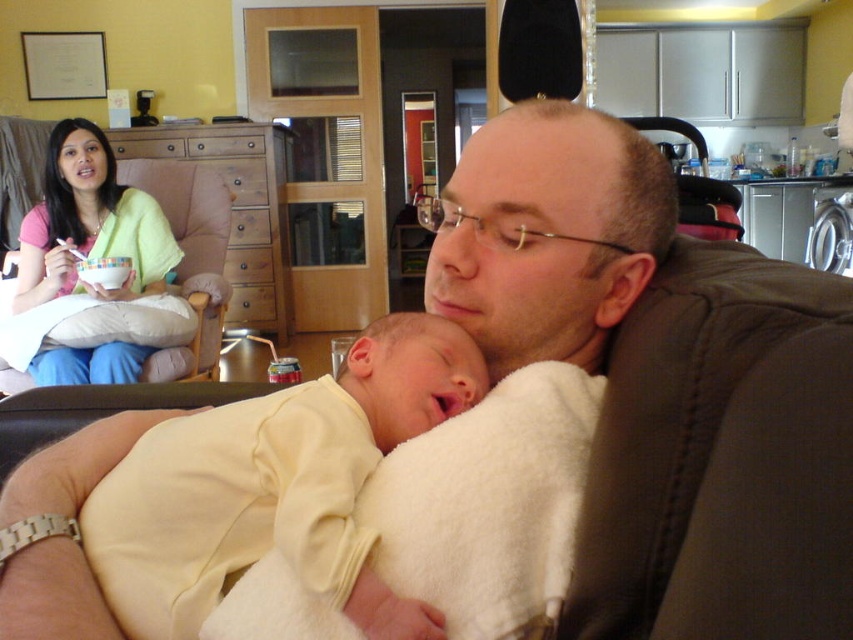
Is soft yellow onesie at center above smooth beige blanket at center?

No.

Does point (225, 420) lie behind point (570, 204)?

That is False.

Find the location of `soft yellow onesie at center`. soft yellow onesie at center is located at coordinates (276, 486).

Looking at this image, is smooth beige blanket at center to the left of pink fabric shirt at upper left from the viewer's perspective?

No, smooth beige blanket at center is not to the left of pink fabric shirt at upper left.

Between point (35, 563) and point (148, 202), which one is positioned in front?

Positioned in front is point (35, 563).

This screenshot has width=853, height=640. Identify the location of smooth beige blanket at center. (x=548, y=234).

This screenshot has height=640, width=853. What are the coordinates of `soft yellow onesie at center` in the screenshot? It's located at (276, 486).

Who is more distant from viewer, (x=392, y=428) or (x=151, y=214)?

Positioned behind is point (x=151, y=214).

Find the location of a particular element. Image resolution: width=853 pixels, height=640 pixels. soft yellow onesie at center is located at coordinates pyautogui.click(x=276, y=486).

In order to click on soft yellow onesie at center in this screenshot , I will do click(276, 486).